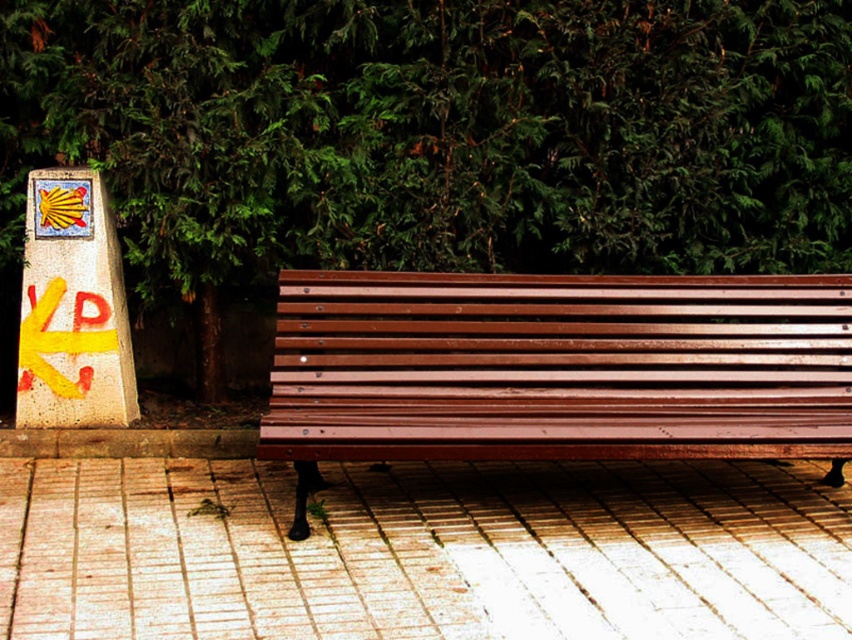
You are sitting on the wooden bench and want to look at both the green leafy tree at upper center and the yellow painted stone signpost at left. Which object is nearer to your eyes?

The green leafy tree at upper center is closer to the viewer than the yellow painted stone signpost at left.

Consider the image. You are standing at the origin point in the image. There is a wooden bench at center. Can you walk directly towards the wooden bench at center without moving past the point marked at coordinate (556, 369)?

The point marked at coordinate (556, 369) indicates the wooden bench at center. Therefore, walking directly towards the wooden bench at center would mean moving towards the point marked at coordinate (556, 369), so you would not move past it.